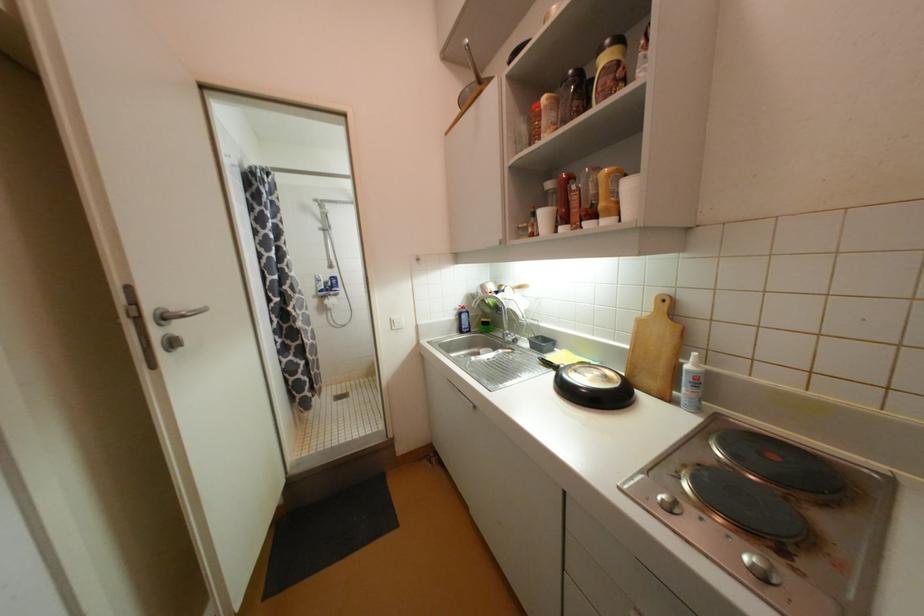
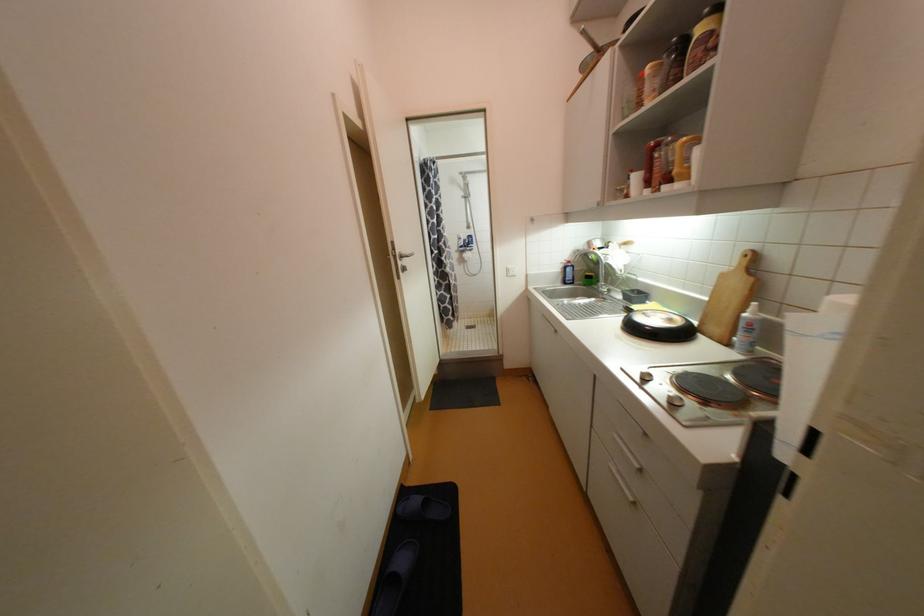
Where in the second image is the point corresponding to pixel 693 368 from the first image?

(750, 315)